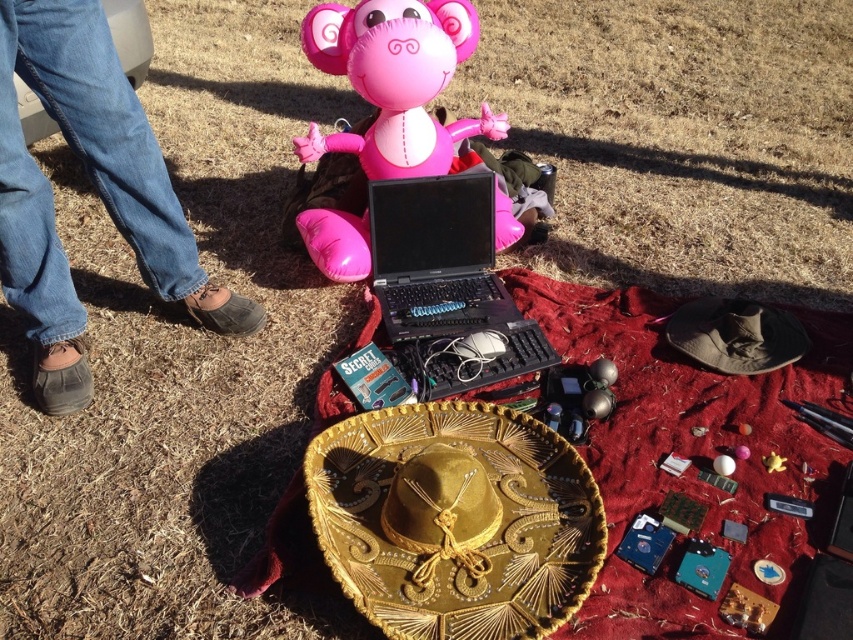
Looking at this image, you are standing in front of the red blanket and want to place a small item on the blanket. You have two points marked on the blanket where you can place it. Which point is closer to you, point [367,88] or point [440,304]?

Point [367,88] is closer to the viewer than point [440,304], so you should place the item there if you want it nearer to you.